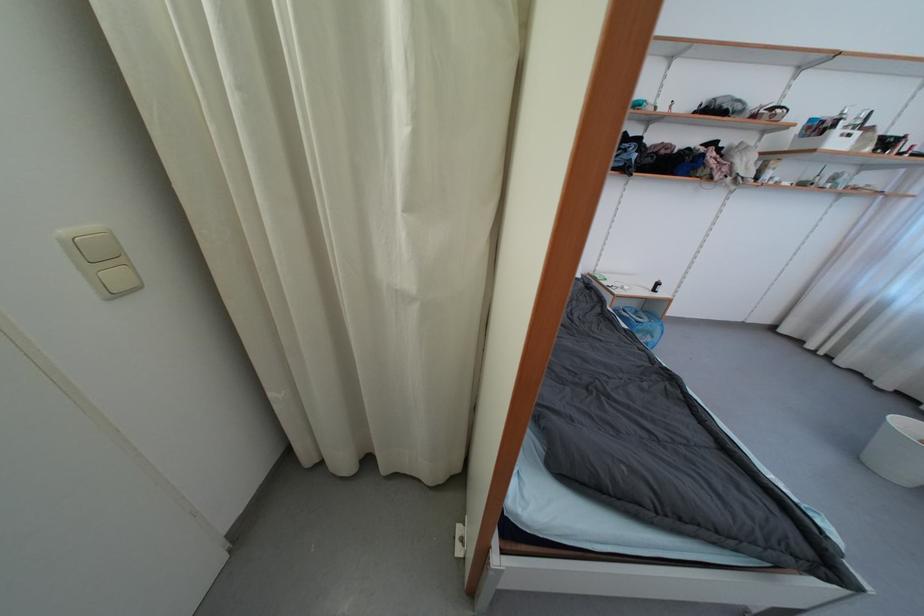
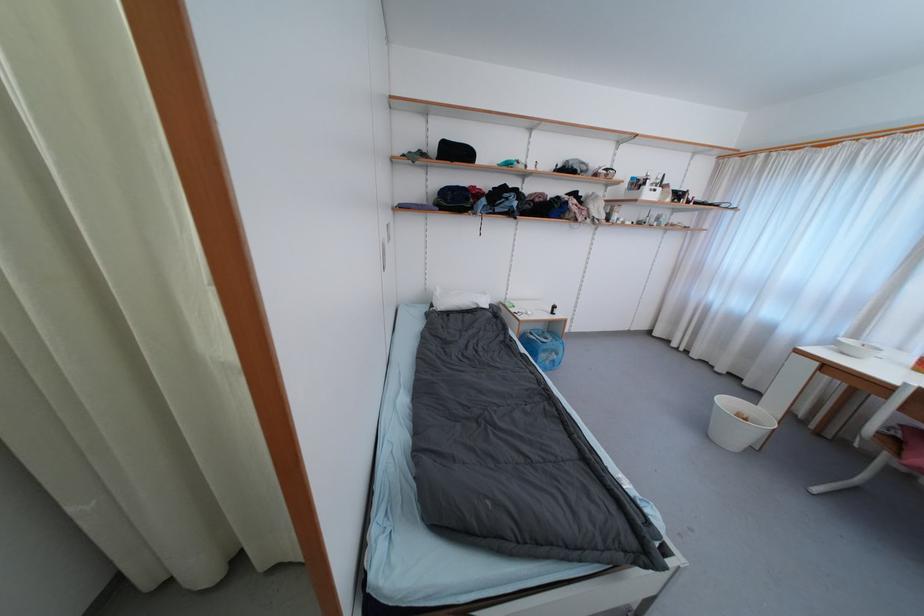
In the second image, find the point that corresponds to (x=628, y=314) in the first image.

(535, 336)